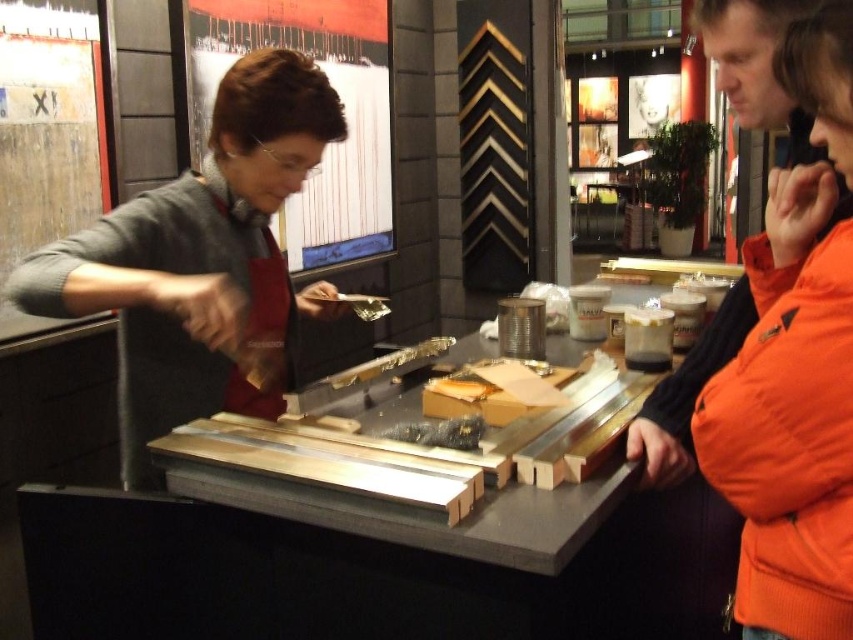
Who is higher up, matte gray sweater at center or orange puffy jacket at right?

matte gray sweater at center

Which is more to the right, matte gray sweater at center or orange puffy jacket at right?

orange puffy jacket at right is more to the right.

Is point (248, 406) positioned behind point (780, 586)?

Yes, it is behind point (780, 586).

The image size is (853, 640). I want to click on matte gray sweater at center, so click(x=200, y=260).

The height and width of the screenshot is (640, 853). What do you see at coordinates (200, 260) in the screenshot?
I see `matte gray sweater at center` at bounding box center [200, 260].

At what (x,y) coordinates should I click in order to perform the action: click on matte gray sweater at center. Please return your answer as a coordinate pair (x, y). Looking at the image, I should click on (200, 260).

Where is `matte gray sweater at center`? Image resolution: width=853 pixels, height=640 pixels. matte gray sweater at center is located at coordinates (200, 260).

Which is behind, point (801, 605) or point (428, 381)?

The point (428, 381) is more distant.

Based on the photo, which is more to the right, orange puffy jacket at right or yellowish matte cheese at center?

Positioned to the right is orange puffy jacket at right.

Describe the element at coordinates (793, 369) in the screenshot. I see `orange puffy jacket at right` at that location.

Find the location of a particular element. Image resolution: width=853 pixels, height=640 pixels. orange puffy jacket at right is located at coordinates pyautogui.click(x=793, y=369).